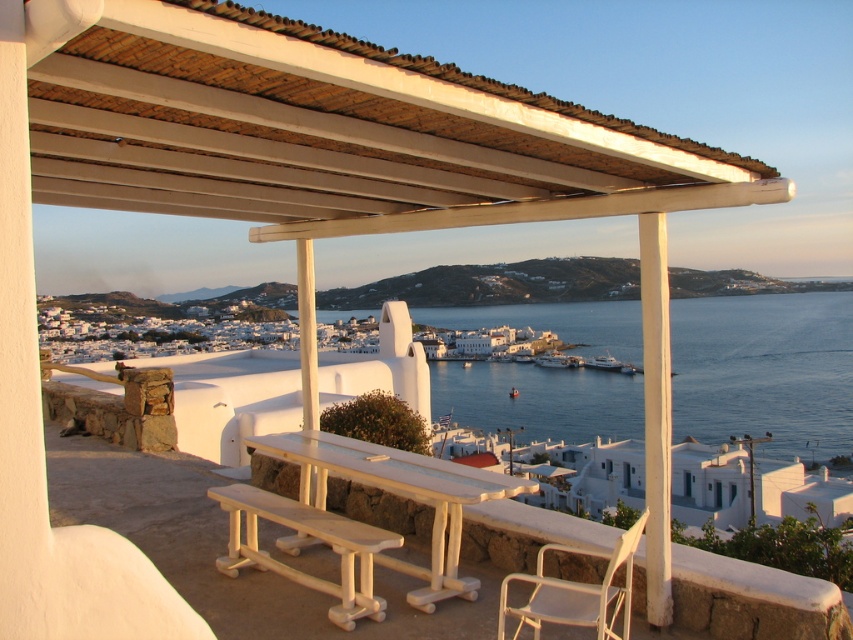
Question: Which of the following is the closest to the observer?

Choices:
 (A) (308, 477)
 (B) (639, 140)
 (C) (599, 358)
 (D) (260, 490)

Answer: (B)

Question: Which point appears farthest from the camera in this image?

Choices:
 (A) (341, 595)
 (B) (421, 456)
 (C) (590, 362)
 (D) (549, 609)

Answer: (C)

Question: Does white wood table at center have a lesser width compared to white glossy boat at center?

Choices:
 (A) no
 (B) yes

Answer: (B)

Question: Can you confirm if white wood bench at lower center is wider than white glossy boat at center?

Choices:
 (A) yes
 (B) no

Answer: (B)

Question: Which point is closer to the camera taking this photo?

Choices:
 (A) (421, 195)
 (B) (622, 365)
 (C) (376, 596)
 (D) (467, 595)

Answer: (C)

Question: Does white wood at upper center appear under white plastic chair at lower right?

Choices:
 (A) yes
 (B) no

Answer: (B)